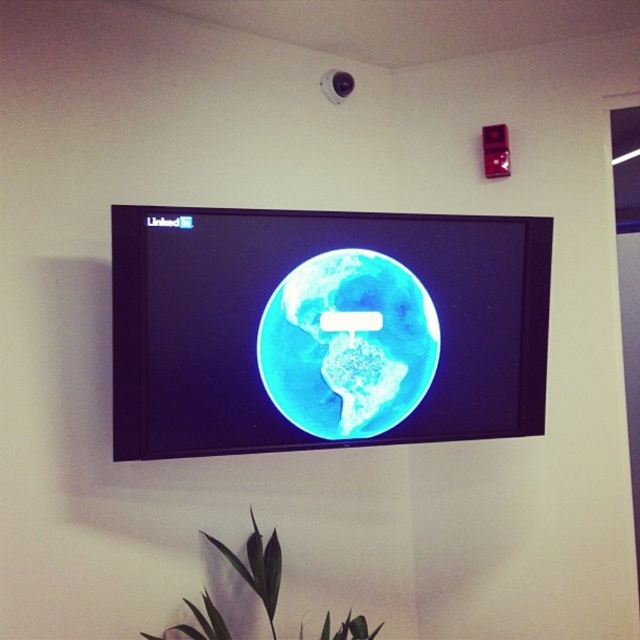
Is blue matte earth at center to the right of green matte leaf at lower center from the viewer's perspective?

Yes, blue matte earth at center is to the right of green matte leaf at lower center.

Between blue matte earth at center and green matte leaf at lower center, which one appears on the left side from the viewer's perspective?

green matte leaf at lower center

Between point (378, 380) and point (257, 570), which one is positioned behind?

Point (378, 380)

In order to click on blue matte earth at center in this screenshot , I will do `click(348, 344)`.

Is blue glossy globe at center positioned behind blue matte earth at center?

No, it is in front of blue matte earth at center.

Is blue glossy globe at center wider than blue matte earth at center?

Indeed, blue glossy globe at center has a greater width compared to blue matte earth at center.

In order to click on blue glossy globe at center in this screenshot , I will do `click(323, 328)`.

Who is positioned more to the right, blue glossy globe at center or green matte leaf at lower center?

blue glossy globe at center is more to the right.

Does point (189, 301) come behind point (273, 632)?

No, it is not.

In order to click on blue glossy globe at center in this screenshot , I will do `click(323, 328)`.